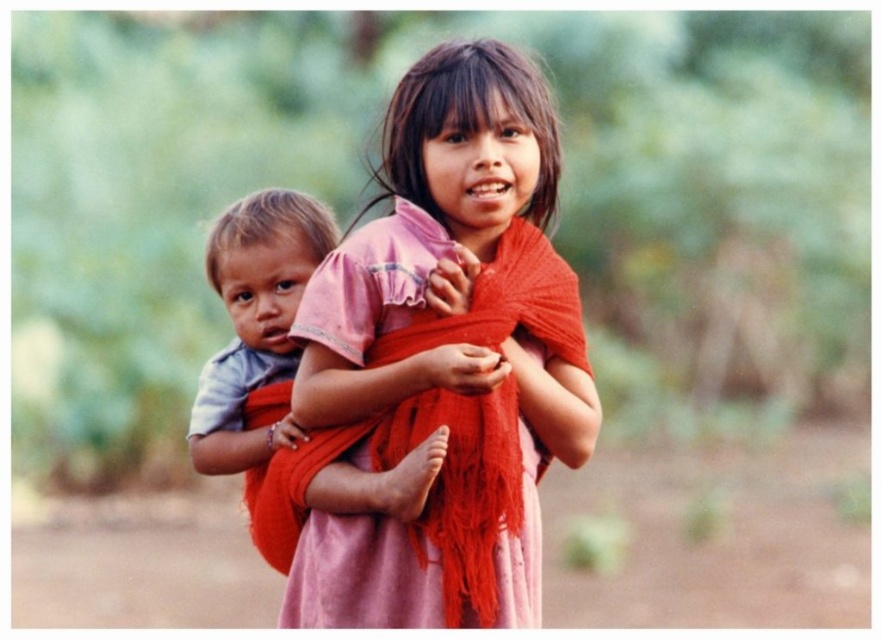
Is point (301, 339) in front of point (225, 419)?

Yes.

Identify the location of matte pink dress at center. Image resolution: width=882 pixels, height=640 pixels. (447, 355).